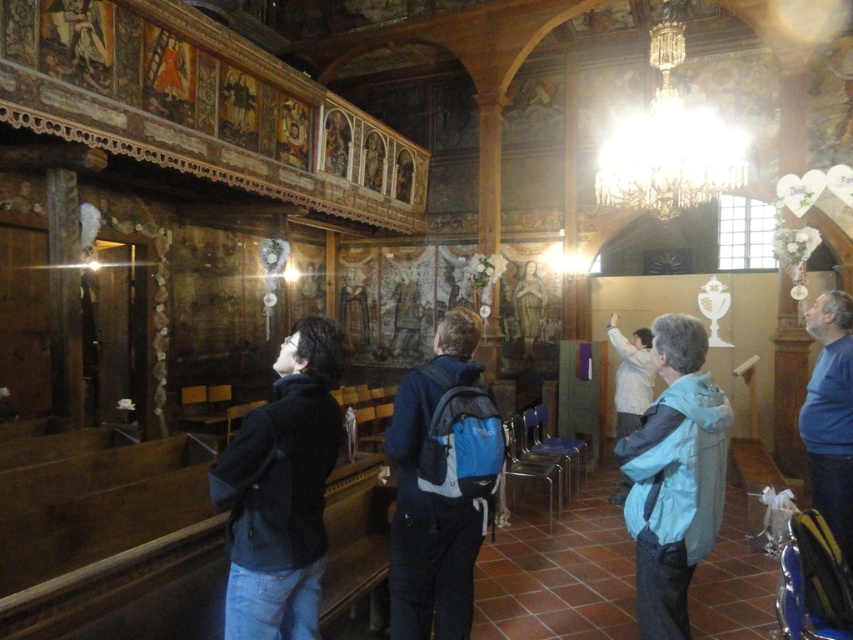
Question: In this image, where is black soft jacket at center located relative to light blue fabric jacket at lower right?

Choices:
 (A) above
 (B) below

Answer: (A)

Question: Among these objects, which one is nearest to the camera?

Choices:
 (A) white matte jacket at center
 (B) blue fabric backpack at center
 (C) black soft jacket at center
 (D) light blue fabric jacket at lower right

Answer: (C)

Question: Which of the following is the closest to the observer?

Choices:
 (A) light blue fabric jacket at lower right
 (B) white matte jacket at center

Answer: (A)

Question: Can you confirm if black soft jacket at center is positioned above light blue fabric jacket at lower right?

Choices:
 (A) no
 (B) yes

Answer: (B)

Question: Which point is closer to the camera?

Choices:
 (A) blue fabric backpack at center
 (B) white matte jacket at center
 (C) black soft jacket at center

Answer: (C)

Question: Is black soft jacket at center positioned before white matte jacket at center?

Choices:
 (A) no
 (B) yes

Answer: (B)